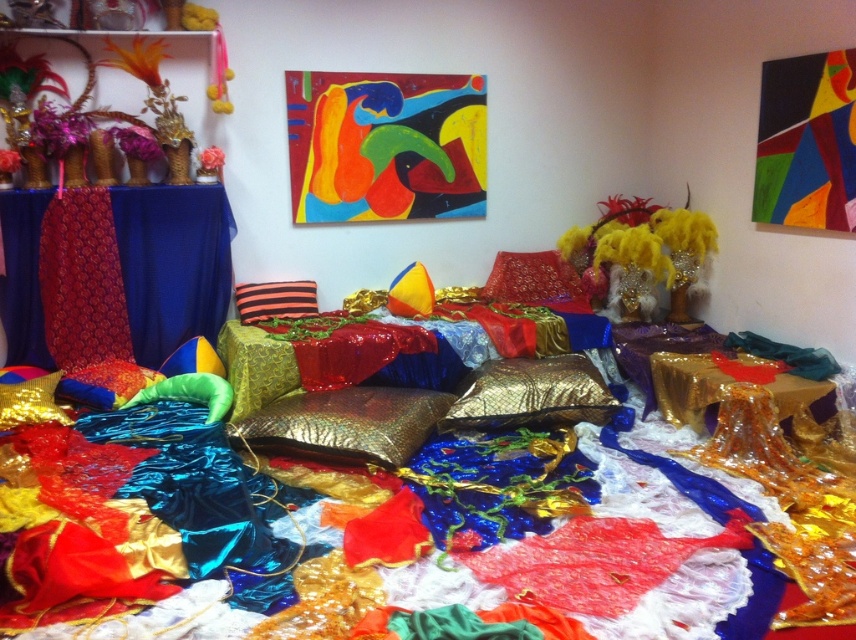
Can you confirm if abstract painting at upper center is thinner than yellow shiny pillow at center?

No, abstract painting at upper center is not thinner than yellow shiny pillow at center.

What do you see at coordinates (385, 145) in the screenshot? I see `abstract painting at upper center` at bounding box center [385, 145].

Does point (382, 86) lie behind point (421, 269)?

No, it is in front of (421, 269).

The image size is (856, 640). What are the coordinates of `abstract painting at upper center` in the screenshot? It's located at (385, 145).

Which is behind, point (593, 378) or point (490, 300)?

The point (490, 300) is more distant.

Can you confirm if gold sequined pillow at center is thinner than shiny red fabric pillow at center?

No, gold sequined pillow at center is not thinner than shiny red fabric pillow at center.

Where is `gold sequined pillow at center`? The height and width of the screenshot is (640, 856). gold sequined pillow at center is located at coordinates (531, 394).

Image resolution: width=856 pixels, height=640 pixels. I want to click on gold sequined pillow at center, so click(x=531, y=394).

Is abstract painting at upper center positioned behind striped fabric pillow at center?

Yes, abstract painting at upper center is behind striped fabric pillow at center.

The image size is (856, 640). Find the location of `abstract painting at upper center`. abstract painting at upper center is located at coordinates (385, 145).

Locate an element on the screen. This screenshot has height=640, width=856. abstract painting at upper center is located at coordinates (385, 145).